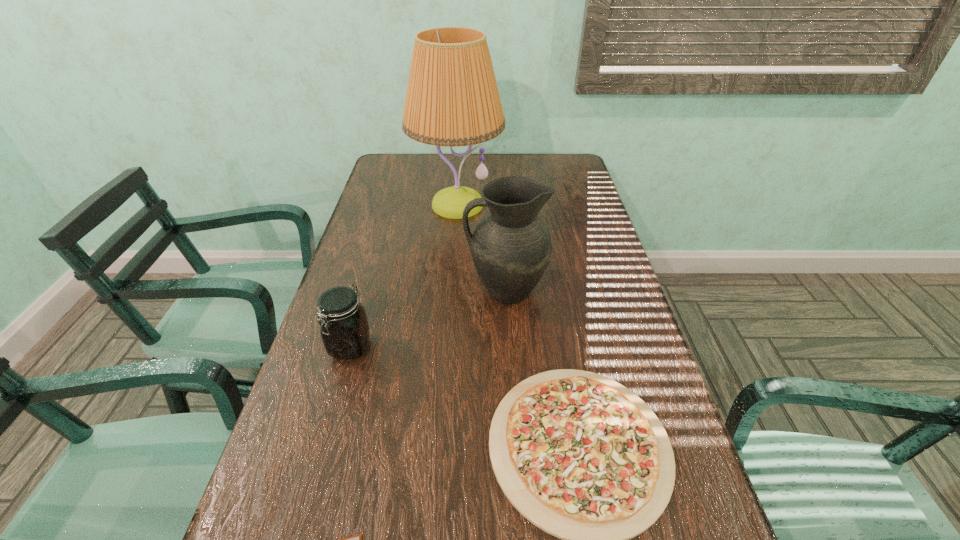
Locate an element on the screen. object that can be found as the second closest to the pizza is located at coordinates (356, 539).

Identify which object is the third closest to the diary. Please provide its 2D coordinates. Your answer should be formatted as a tuple, i.e. [(x, y)], where the tuple contains the x and y coordinates of a point satisfying the conditions above.

[(511, 247)]

Identify the location of vacant space that satisfies the following two spatial constraints: 1. on the side of the fourth shortest object with the handle; 2. on the lid of the third shortest object. The width and height of the screenshot is (960, 540). point(509,347).